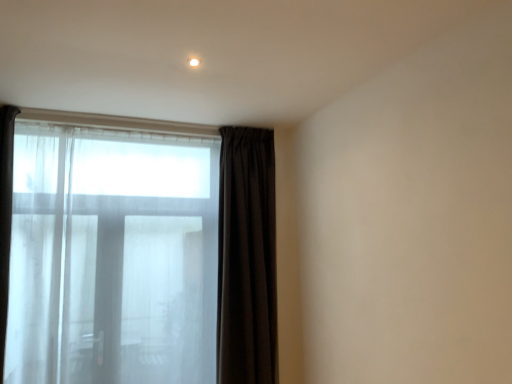
Question: From the image's perspective, is transparent fabric bay window at left above or below dark matte curtain at center?

Choices:
 (A) above
 (B) below

Answer: (B)

Question: Is transparent fabric bay window at left wider or thinner than dark matte curtain at center?

Choices:
 (A) thin
 (B) wide

Answer: (A)

Question: Which object is the closest to the dark matte curtain at center?

Choices:
 (A) white glossy light at upper center
 (B) transparent fabric bay window at left

Answer: (B)

Question: Considering the real-world distances, which object is closest to the transparent fabric bay window at left?

Choices:
 (A) white glossy light at upper center
 (B) dark matte curtain at center

Answer: (B)